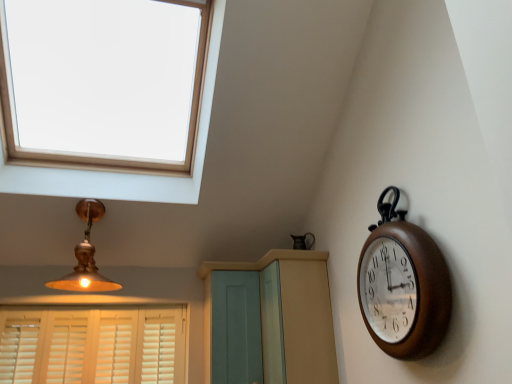
Question: Is light blue wood screen door at center aimed at white wood blinds at lower left?

Choices:
 (A) yes
 (B) no

Answer: (B)

Question: Is there a large distance between light blue wood screen door at center and white wood blinds at lower left?

Choices:
 (A) no
 (B) yes

Answer: (A)

Question: Can you confirm if light blue wood screen door at center is taller than white wood blinds at lower left?

Choices:
 (A) yes
 (B) no

Answer: (A)

Question: Is light blue wood screen door at center to the left of white wood blinds at lower left from the viewer's perspective?

Choices:
 (A) no
 (B) yes

Answer: (A)

Question: From the image's perspective, would you say light blue wood screen door at center is shown under white wood blinds at lower left?

Choices:
 (A) yes
 (B) no

Answer: (B)

Question: From a real-world perspective, is white wood blinds at lower left above or below matte gold lampshade at upper left?

Choices:
 (A) above
 (B) below

Answer: (B)

Question: Considering the positions of white wood blinds at lower left and matte gold lampshade at upper left in the image, is white wood blinds at lower left wider or thinner than matte gold lampshade at upper left?

Choices:
 (A) wide
 (B) thin

Answer: (B)

Question: Based on their sizes in the image, would you say white wood blinds at lower left is bigger or smaller than matte gold lampshade at upper left?

Choices:
 (A) big
 (B) small

Answer: (B)

Question: Is point (93, 377) closer or farther from the camera than point (103, 208)?

Choices:
 (A) farther
 (B) closer

Answer: (A)

Question: From the image's perspective, is light blue wood screen door at center above or below white wood blinds at lower left?

Choices:
 (A) below
 (B) above

Answer: (B)

Question: Looking at their shapes, would you say light blue wood screen door at center is wider or thinner than white wood blinds at lower left?

Choices:
 (A) wide
 (B) thin

Answer: (A)

Question: From a real-world perspective, relative to white wood blinds at lower left, is light blue wood screen door at center vertically above or below?

Choices:
 (A) below
 (B) above

Answer: (B)

Question: Is light blue wood screen door at center in front of or behind white wood blinds at lower left in the image?

Choices:
 (A) behind
 (B) front

Answer: (B)

Question: In terms of size, does brown wooden clock at right appear bigger or smaller than light blue wood screen door at center?

Choices:
 (A) small
 (B) big

Answer: (A)

Question: From their relative heights in the image, would you say brown wooden clock at right is taller or shorter than light blue wood screen door at center?

Choices:
 (A) short
 (B) tall

Answer: (B)